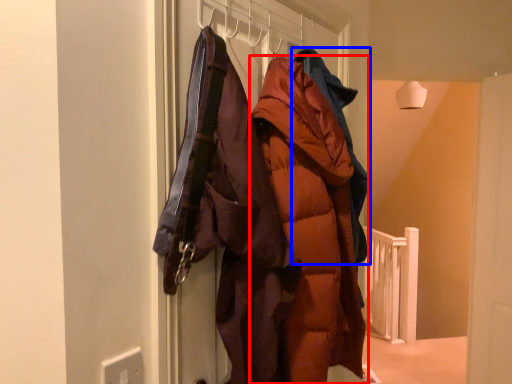
Question: Which object appears farthest to the camera in this image, coat (highlighted by a red box) or jacket (highlighted by a blue box)?

Choices:
 (A) coat
 (B) jacket

Answer: (B)